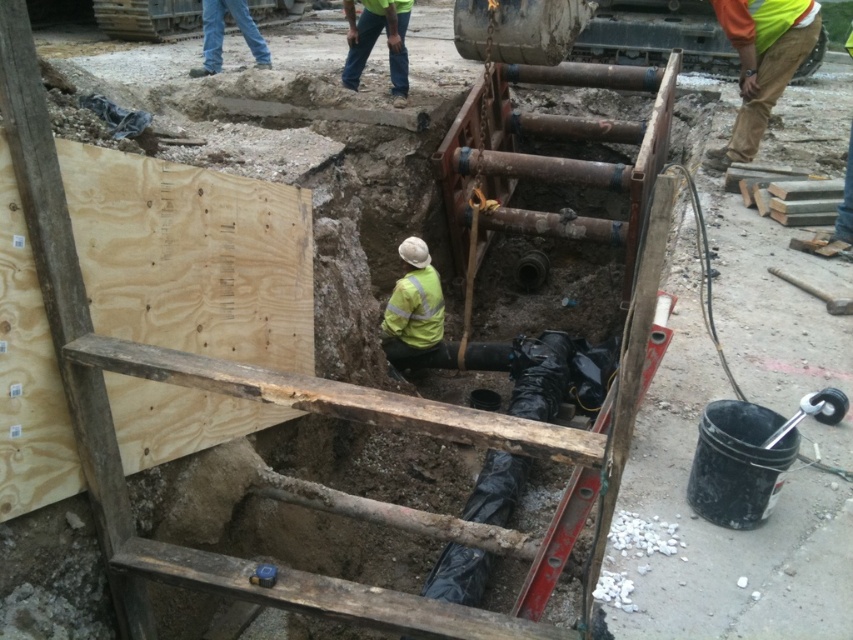
Does green reflective jacket at center appear over green high-visibility jacket at upper center?

Actually, green reflective jacket at center is below green high-visibility jacket at upper center.

Looking at this image, does green reflective jacket at center have a greater height compared to green high-visibility jacket at upper center?

No, green reflective jacket at center is not taller than green high-visibility jacket at upper center.

Is point (436, 339) positioned before point (389, 76)?

That is True.

The image size is (853, 640). I want to click on green reflective jacket at center, so click(x=413, y=307).

Between green reflective jacket at center and blue jeans at upper left, which one appears on the right side from the viewer's perspective?

green reflective jacket at center is more to the right.

Does green reflective jacket at center appear on the right side of blue jeans at upper left?

Yes, green reflective jacket at center is to the right of blue jeans at upper left.

Who is more distant from viewer, (434, 310) or (216, 19)?

Positioned behind is point (216, 19).

Locate an element on the screen. Image resolution: width=853 pixels, height=640 pixels. green reflective jacket at center is located at coordinates (413, 307).

Which is behind, point (392, 17) or point (218, 33)?

Positioned behind is point (218, 33).

Which is above, green high-visibility jacket at upper center or blue jeans at upper left?

blue jeans at upper left is above.

Image resolution: width=853 pixels, height=640 pixels. What are the coordinates of `green high-visibility jacket at upper center` in the screenshot? It's located at (375, 38).